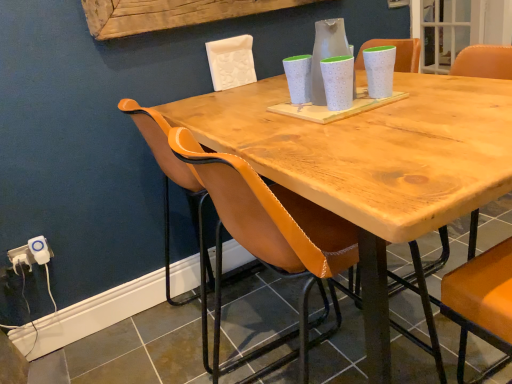
Question: Should I look upward or downward to see white dotted vase at center?

Choices:
 (A) down
 (B) up

Answer: (B)

Question: Is white plastic electric outlet at lower left, which appears as the first electric outlet when viewed from the right, shorter than leather at left?

Choices:
 (A) no
 (B) yes

Answer: (B)

Question: Does white plastic electric outlet at lower left, which appears as the first electric outlet when viewed from the right, touch leather at left?

Choices:
 (A) no
 (B) yes

Answer: (A)

Question: Could leather at left be considered to be inside white plastic electric outlet at lower left, which is counted as the 2th electric outlet, starting from the left?

Choices:
 (A) yes
 (B) no

Answer: (B)

Question: Is white plastic electric outlet at lower left, which appears as the first electric outlet when viewed from the right, smaller than leather at left?

Choices:
 (A) yes
 (B) no

Answer: (A)

Question: Is white plastic electric outlet at lower left, which appears as the first electric outlet when viewed from the right, wider than leather at left?

Choices:
 (A) yes
 (B) no

Answer: (B)

Question: From a real-world perspective, is white plastic electric outlet at lower left, which is counted as the 2th electric outlet, starting from the left, on top of leather at left?

Choices:
 (A) no
 (B) yes

Answer: (A)

Question: Is white dotted vase at center thinner than white plastic electric outlet at lower left, the 2th electric outlet from the right?

Choices:
 (A) yes
 (B) no

Answer: (B)

Question: From a real-world perspective, is white dotted vase at center over white plastic electric outlet at lower left, positioned as the 1th electric outlet in left-to-right order?

Choices:
 (A) no
 (B) yes

Answer: (B)

Question: Considering the relative positions of white dotted vase at center and white plastic electric outlet at lower left, the 2th electric outlet from the right, in the image provided, is white dotted vase at center to the right of white plastic electric outlet at lower left, the 2th electric outlet from the right, from the viewer's perspective?

Choices:
 (A) no
 (B) yes

Answer: (B)

Question: Is white dotted vase at center positioned before white plastic electric outlet at lower left, the 2th electric outlet from the right?

Choices:
 (A) yes
 (B) no

Answer: (A)

Question: Considering the relative sizes of white dotted vase at center and white plastic electric outlet at lower left, the 2th electric outlet from the right, in the image provided, is white dotted vase at center wider than white plastic electric outlet at lower left, the 2th electric outlet from the right,?

Choices:
 (A) yes
 (B) no

Answer: (A)

Question: Is white dotted vase at center smaller than white plastic electric outlet at lower left, the 2th electric outlet from the right?

Choices:
 (A) yes
 (B) no

Answer: (B)

Question: Is white dotted vase at center looking in the opposite direction of leather at left?

Choices:
 (A) yes
 (B) no

Answer: (B)